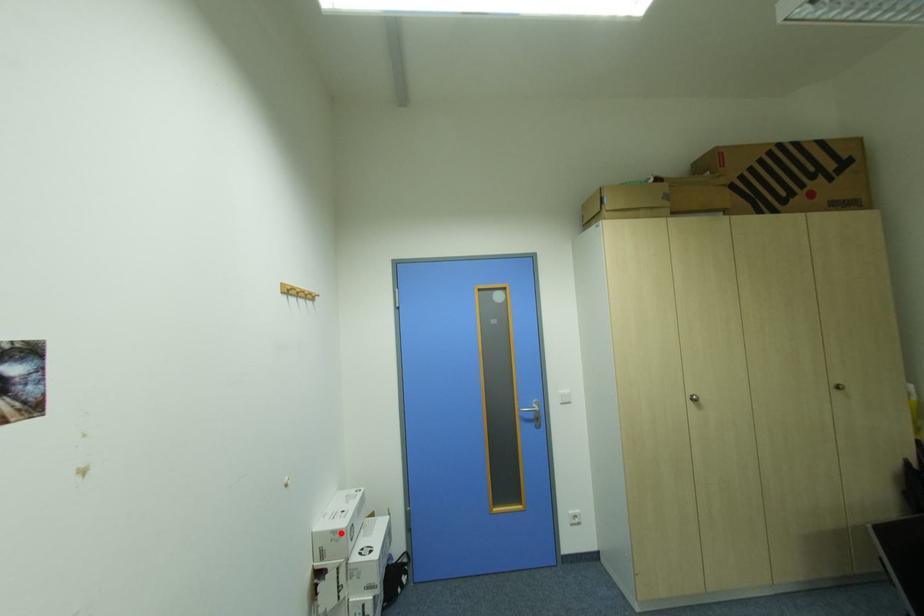
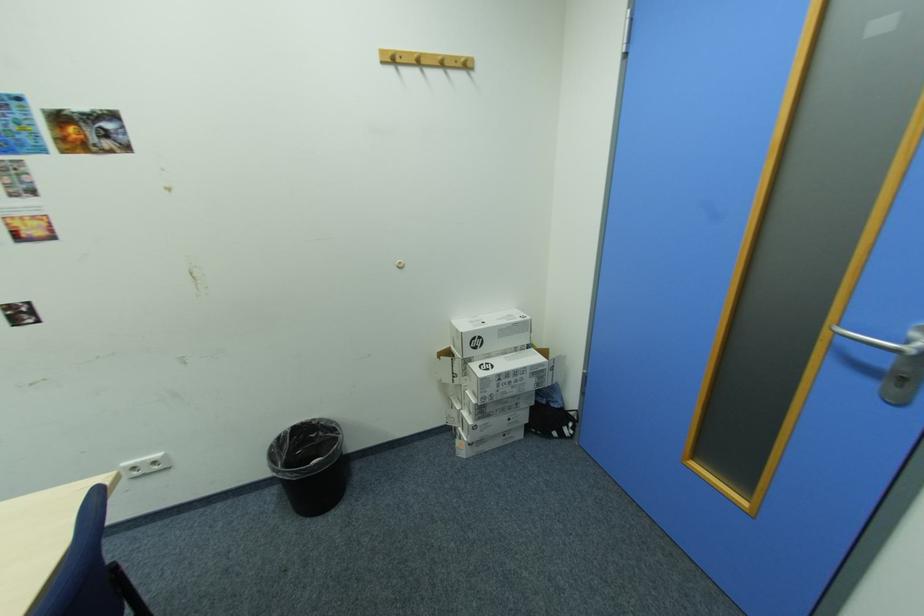
The point at the highlighted location is marked in the first image. Where is the corresponding point in the second image?

(465, 331)